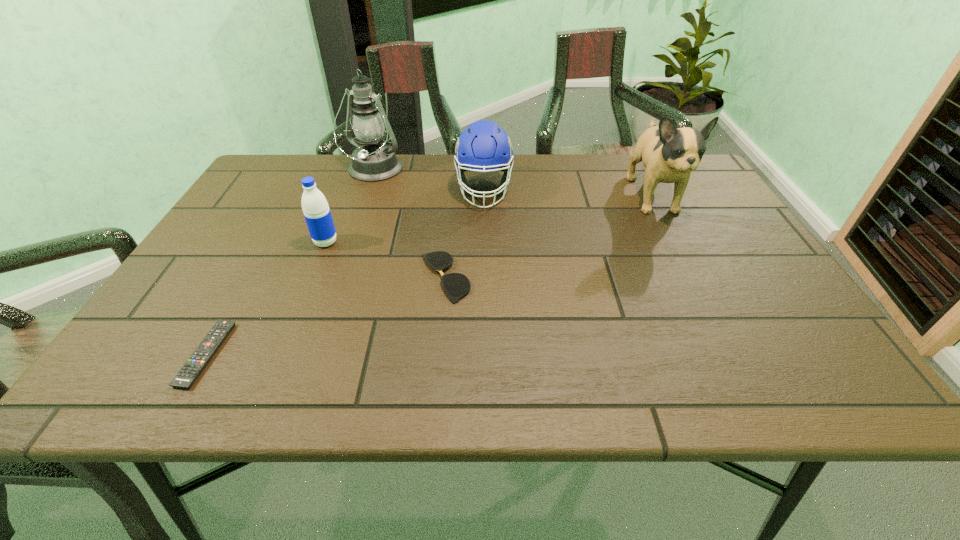
Image resolution: width=960 pixels, height=540 pixels. What are the coordinates of `oil lamp` in the screenshot? It's located at (373, 161).

Where is `the rightmost object`? the rightmost object is located at coordinates (669, 154).

The image size is (960, 540). Find the location of `football helmet`. football helmet is located at coordinates (483, 146).

At what (x,y) coordinates should I click in order to perform the action: click on the third nearest object. Please return your answer as a coordinate pair (x, y). The image size is (960, 540). Looking at the image, I should click on (315, 207).

In order to click on the second nearest object in this screenshot , I will do `click(456, 285)`.

The image size is (960, 540). Identify the location of spectacles. (456, 285).

Where is `the nearest object`? The width and height of the screenshot is (960, 540). the nearest object is located at coordinates (187, 375).

Identify the location of the shortest object. (187, 375).

This screenshot has height=540, width=960. Find the location of `vacant region located 0.110m on the left of the oil lamp`. vacant region located 0.110m on the left of the oil lamp is located at coordinates (308, 170).

Where is `vacant region located 0.050m at the face of the puppy`? The height and width of the screenshot is (540, 960). vacant region located 0.050m at the face of the puppy is located at coordinates (676, 240).